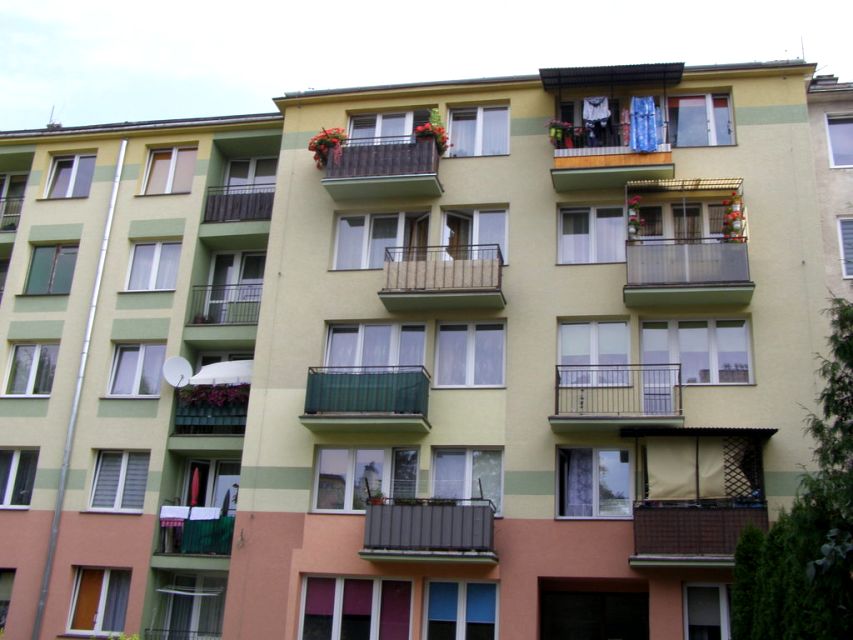
At what (x,y) coordinates should I click in order to perform the action: click on doorway. Please return your answer as a coordinate pair (x, y). Looking at the image, I should click on (569, 617).